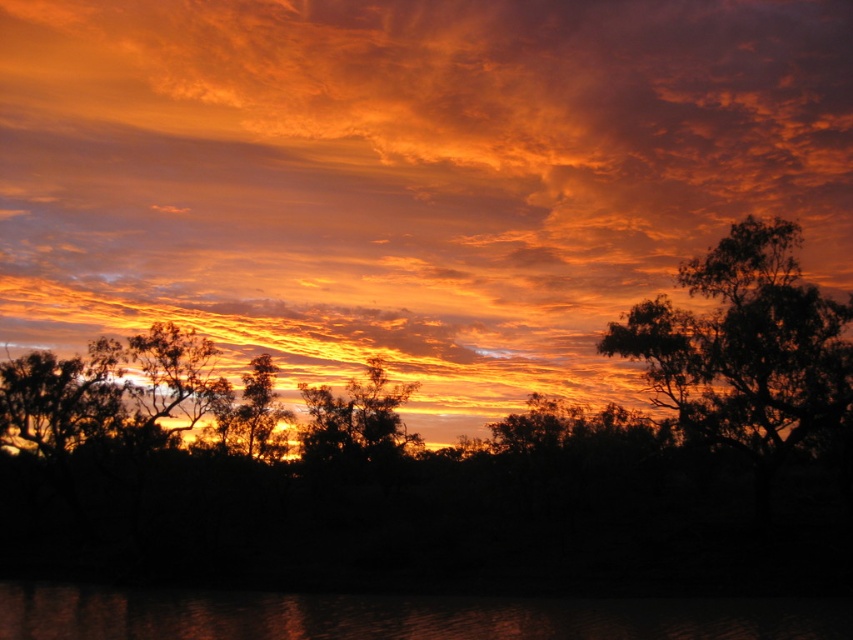
Can you confirm if orange matte cloud at upper center is bigger than silhouette tree at center?

Correct, orange matte cloud at upper center is larger in size than silhouette tree at center.

The image size is (853, 640). Describe the element at coordinates (407, 177) in the screenshot. I see `orange matte cloud at upper center` at that location.

You are a GUI agent. You are given a task and a screenshot of the screen. Output one action in this format:
    pyautogui.click(x=<x>, y=<y>)
    Task: Click on the orange matte cloud at upper center
    
    Given the screenshot: What is the action you would take?
    pyautogui.click(x=407, y=177)

Does point (368, 301) come closer to viewer compared to point (682, 312)?

No, it is behind (682, 312).

Does orange matte cloud at upper center appear on the left side of dark green leafy tree at right?

Yes, orange matte cloud at upper center is to the left of dark green leafy tree at right.

Locate an element on the screen. The height and width of the screenshot is (640, 853). orange matte cloud at upper center is located at coordinates (407, 177).

Can you confirm if orange matte cloud at upper center is bigger than glossy reflective water at lower center?

Indeed, orange matte cloud at upper center has a larger size compared to glossy reflective water at lower center.

This screenshot has width=853, height=640. What do you see at coordinates (407, 177) in the screenshot?
I see `orange matte cloud at upper center` at bounding box center [407, 177].

Who is more forward, (444,321) or (631,605)?

Point (631,605) is in front.

Find the location of `orange matte cloud at upper center`. orange matte cloud at upper center is located at coordinates (407, 177).